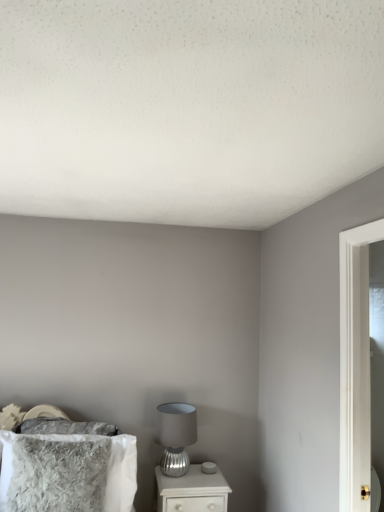
The width and height of the screenshot is (384, 512). What do you see at coordinates (192, 490) in the screenshot?
I see `white glossy nightstand at lower center` at bounding box center [192, 490].

The image size is (384, 512). I want to click on white glossy nightstand at lower center, so click(x=192, y=490).

Does white glossy nightstand at lower center touch satin silver table lamp at lower center?

white glossy nightstand at lower center and satin silver table lamp at lower center are not in contact.

From a real-world perspective, which object stands above the other?

satin silver table lamp at lower center, from a real-world perspective.

Locate an element on the screen. The width and height of the screenshot is (384, 512). table lamp that appears behind the white glossy nightstand at lower center is located at coordinates (176, 436).

Which of these two, white glossy nightstand at lower center or satin silver table lamp at lower center, is bigger?

With larger size is white glossy nightstand at lower center.

Which is correct: satin silver table lamp at lower center is inside white glossy nightstand at lower center, or outside of it?

satin silver table lamp at lower center is spatially situated outside white glossy nightstand at lower center.

Can you confirm if satin silver table lamp at lower center is shorter than white glossy nightstand at lower center?

Incorrect, the height of satin silver table lamp at lower center does not fall short of that of white glossy nightstand at lower center.

Looking at this image, is satin silver table lamp at lower center oriented away from white glossy nightstand at lower center?

No, satin silver table lamp at lower center's orientation is not away from white glossy nightstand at lower center.

Is fuzzy gray pillow at lower left touching satin silver table lamp at lower center?

No, fuzzy gray pillow at lower left is not beside satin silver table lamp at lower center.

Based on the photo, considering the relative sizes of fuzzy gray pillow at lower left and satin silver table lamp at lower center in the image provided, is fuzzy gray pillow at lower left wider than satin silver table lamp at lower center?

No, fuzzy gray pillow at lower left is not wider than satin silver table lamp at lower center.

Between point (92, 431) and point (169, 453), which one is positioned behind?

The point (169, 453) is more distant.

Between fuzzy gray pillow at lower left and satin silver table lamp at lower center, which one has less height?

Standing shorter between the two is satin silver table lamp at lower center.

Is satin silver table lamp at lower center inside or outside of fuzzy gray pillow at lower left?

→ satin silver table lamp at lower center is spatially situated outside fuzzy gray pillow at lower left.

Is satin silver table lamp at lower center not near fuzzy gray pillow at lower left?

That's not correct — satin silver table lamp at lower center is a little close to fuzzy gray pillow at lower left.

From the image's perspective, does satin silver table lamp at lower center appear higher than fuzzy gray pillow at lower left?

Actually, satin silver table lamp at lower center appears below fuzzy gray pillow at lower left in the image.

Is satin silver table lamp at lower center taller than fuzzy gray pillow at lower left?

No, satin silver table lamp at lower center is not taller than fuzzy gray pillow at lower left.

From a real-world perspective, who is located lower, fuzzy gray pillow at lower left or white glossy nightstand at lower center?

white glossy nightstand at lower center is physically lower.

Considering the relative positions of fuzzy gray pillow at lower left and white glossy nightstand at lower center in the image provided, is fuzzy gray pillow at lower left behind white glossy nightstand at lower center?

No, fuzzy gray pillow at lower left is closer to the viewer.

From the image's perspective, is fuzzy gray pillow at lower left located above white glossy nightstand at lower center?

Yes, from the image's perspective, fuzzy gray pillow at lower left is over white glossy nightstand at lower center.

Does fuzzy gray pillow at lower left have a greater width compared to white glossy nightstand at lower center?

No.

From the picture: Is white glossy nightstand at lower center aimed at fuzzy gray pillow at lower left?

No, white glossy nightstand at lower center is not facing towards fuzzy gray pillow at lower left.

Is white glossy nightstand at lower center far from fuzzy gray pillow at lower left?

No, white glossy nightstand at lower center is in close proximity to fuzzy gray pillow at lower left.

Is white glossy nightstand at lower center smaller than fuzzy gray pillow at lower left?

Yes.

Looking at this image, is white glossy nightstand at lower center behind fuzzy gray pillow at lower left?

That is True.

You are a GUI agent. You are given a task and a screenshot of the screen. Output one action in this format:
    pyautogui.click(x=<x>, y=<y>)
    Task: Click on the nightstand beneath the satin silver table lamp at lower center (from a real-world perspective)
    The width and height of the screenshot is (384, 512).
    Given the screenshot: What is the action you would take?
    pyautogui.click(x=192, y=490)

Locate an element on the screen. The width and height of the screenshot is (384, 512). table lamp behind the white glossy nightstand at lower center is located at coordinates (176, 436).

When comparing their distances from satin silver table lamp at lower center, does fuzzy gray pillow at lower left or white glossy nightstand at lower center seem further?

fuzzy gray pillow at lower left is further to satin silver table lamp at lower center.

Considering their positions, is satin silver table lamp at lower center positioned closer to fuzzy gray pillow at lower left than white glossy nightstand at lower center?

The object closer to fuzzy gray pillow at lower left is white glossy nightstand at lower center.

Estimate the real-world distances between objects in this image. Which object is closer to white glossy nightstand at lower center, fuzzy gray pillow at lower left or satin silver table lamp at lower center?

satin silver table lamp at lower center is positioned closer to the anchor white glossy nightstand at lower center.

Considering their positions, is white glossy nightstand at lower center positioned further to fuzzy gray pillow at lower left than satin silver table lamp at lower center?

satin silver table lamp at lower center is positioned further to the anchor fuzzy gray pillow at lower left.

Based on their spatial positions, is satin silver table lamp at lower center or fuzzy gray pillow at lower left closer to white glossy nightstand at lower center?

satin silver table lamp at lower center is positioned closer to the anchor white glossy nightstand at lower center.

Estimate the real-world distances between objects in this image. Which object is closer to satin silver table lamp at lower center, white glossy nightstand at lower center or fuzzy gray pillow at lower left?

Based on the image, white glossy nightstand at lower center appears to be nearer to satin silver table lamp at lower center.

At what (x,y) coordinates should I click in order to perform the action: click on table lamp between fuzzy gray pillow at lower left and white glossy nightstand at lower center. Please return your answer as a coordinate pair (x, y). The image size is (384, 512). Looking at the image, I should click on [x=176, y=436].